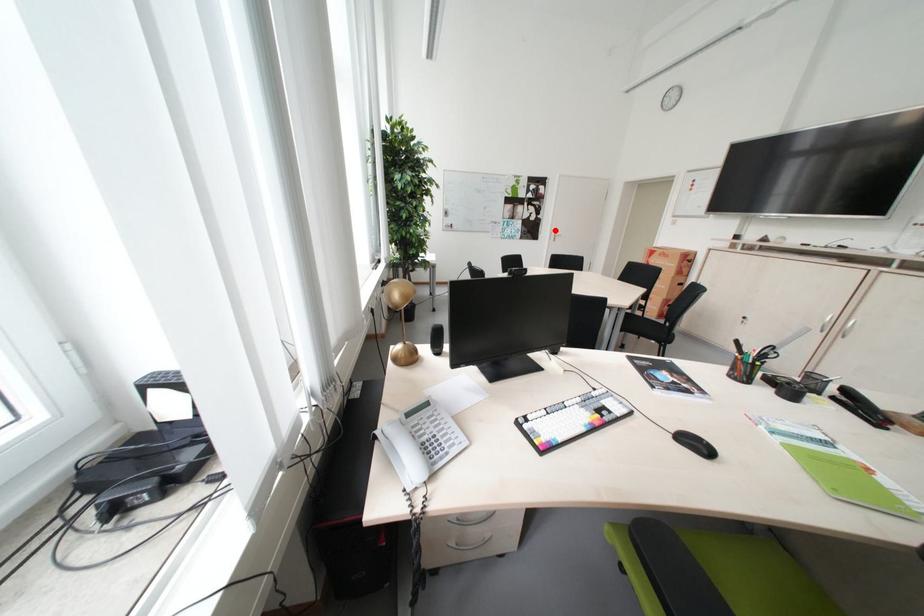
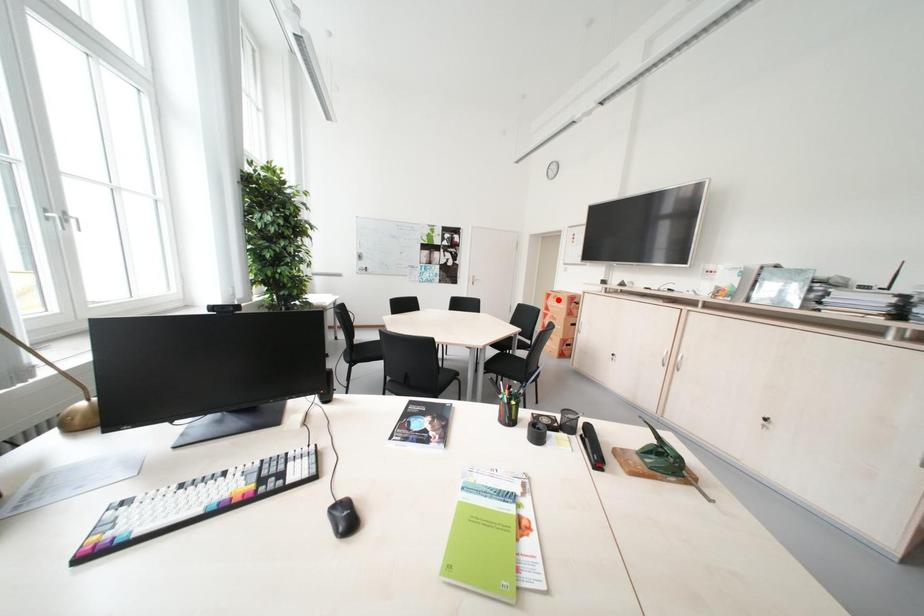
I am providing you with two images of the same scene from different viewpoints. A red point is marked on the first image and another point is marked on the second image. Do the highlighted points in image1 and image2 indicate the same real-world spot?

No